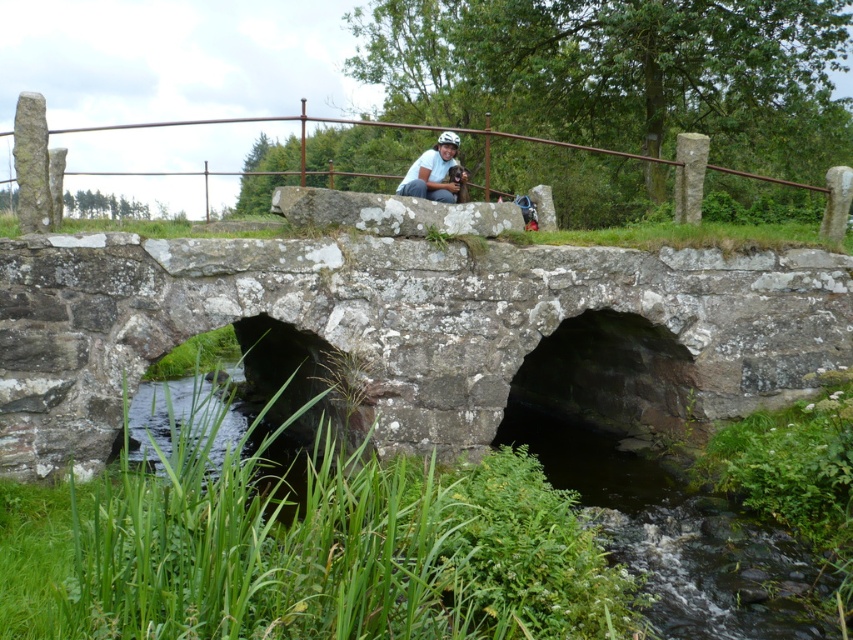
You are standing at the point marked by the coordinates point (x=413, y=332) in the image of a rustic stone bridge over a stream. What structure are you most likely standing on?

The point (x=413, y=332) indicates that you are standing on the rusty stone bridge at center.

You are standing on the rustic stone bridge and want to know where the metallic brown rail at upper center is located. According to the coordinates given, what are its exact coordinates?

The metallic brown rail at upper center is located at coordinates point (132, 170).

You are planning to cross the rusty stone bridge at center with a cart that is 3 meters wide. The metallic brown rail at upper center is in your path. Based on the scene description, can your cart fit through the bridge?

The rusty stone bridge at center has a lesser width compared to metallic brown rail at upper center. Since the bridge is narrower than the rail, the cart that is 3 meters wide might not fit through the bridge if the bridge is narrower than 3 meters. However, the exact width of the bridge isn not provided, so it is uncertain.